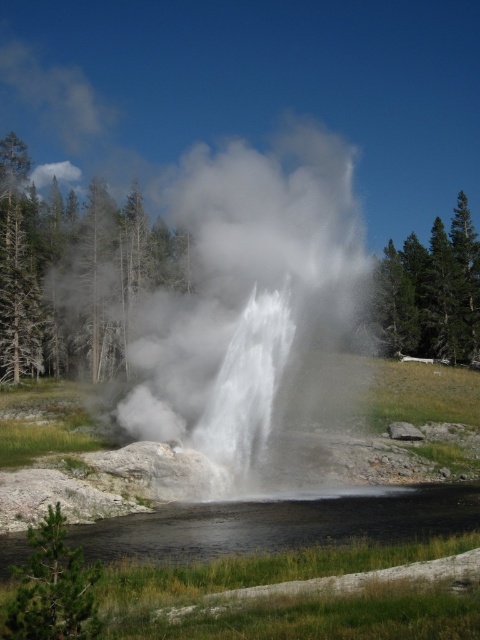
Is white vapor at center above black glossy water at center?

Correct, white vapor at center is located above black glossy water at center.

Between point (203, 262) and point (188, 522), which one is positioned in front?

Point (188, 522) is more forward.

The width and height of the screenshot is (480, 640). I want to click on white vapor at center, so click(x=247, y=304).